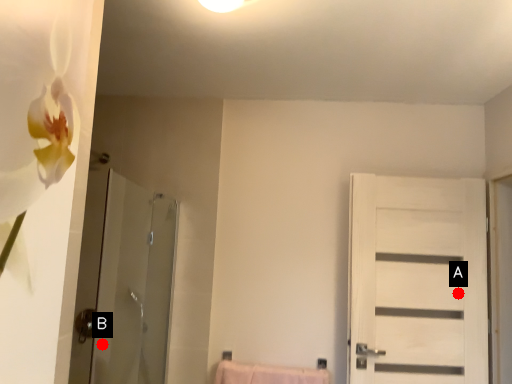
Question: Two points are circled on the image, labeled by A and B beside each circle. Which of the following is the closest to the observer?

Choices:
 (A) A is closer
 (B) B is closer

Answer: (A)